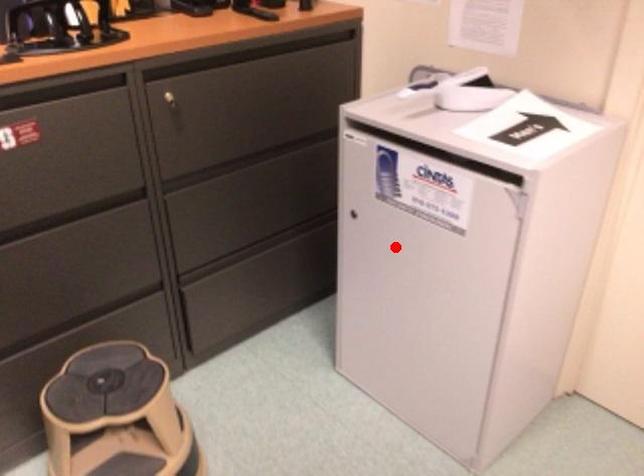
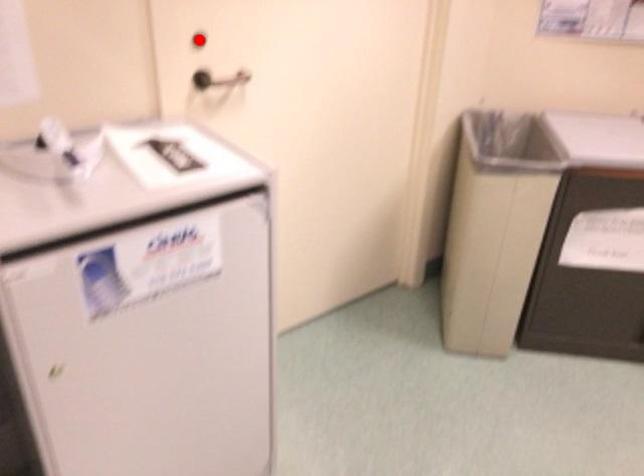
I am providing you with two images of the same scene from different viewpoints. A red point is marked on the first image and another point is marked on the second image. Are the points marked in image1 and image2 representing the same 3D position?

No